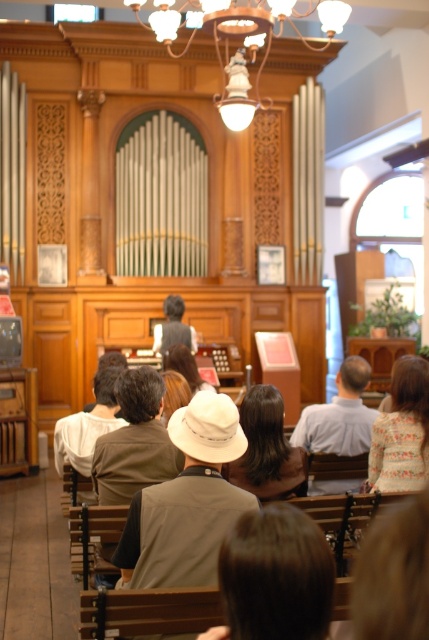
You are attending a casual event in this church and notice the matte brass chandelier at upper center and the light brown leather jacket at center. Which object is positioned higher in the room?

The matte brass chandelier at upper center is located above the light brown leather jacket at center, so it is positioned higher in the room.

From the picture: You are a photographer standing at the back of the church. You want to take a photo that includes both the matte brass chandelier at upper center and the light brown leather jacket at center. Given that your camera has a maximum focus range of 3 meters, will you be able to capture both objects in focus without moving your position?

The matte brass chandelier at upper center and the light brown leather jacket at center are 3.46 meters apart. Since the distance between them exceeds the camera maximum focus range of 3 meters, you won that be able to capture both objects in focus without moving your position.

You are standing in the church and want to reach the matte brass chandelier at upper center to adjust its light. Considering your height is 1.7 meters, can you reach it without any tools?

The matte brass chandelier at upper center is 5.03 meters from viewer. Since your height is 1.7 meters, you cannot reach it without assistance or tools as the distance is much greater than your height.